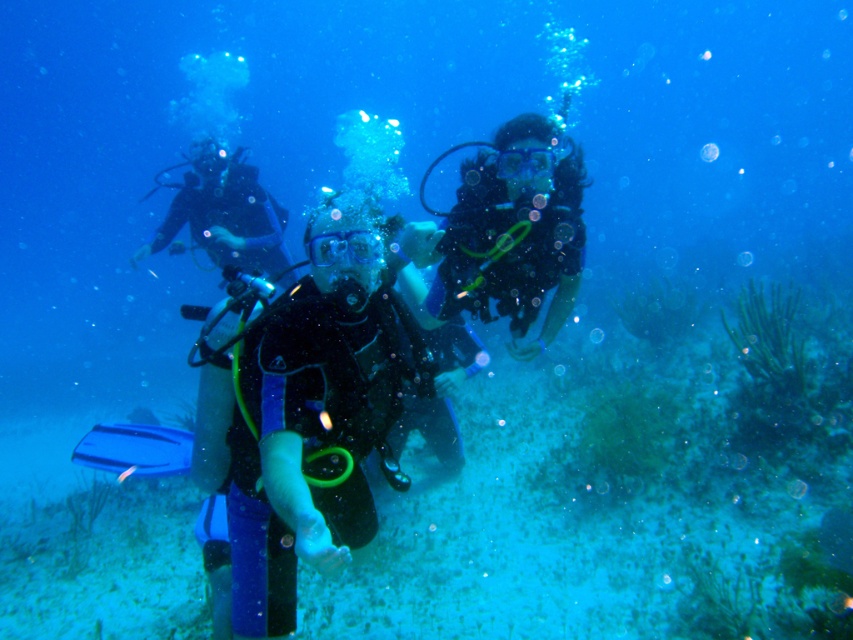
Is black matte scuba diver at center smaller than matte black scuba diver at center?

No, black matte scuba diver at center is not smaller than matte black scuba diver at center.

Is black matte scuba diver at center wider than matte black scuba diver at center?

Indeed, black matte scuba diver at center has a greater width compared to matte black scuba diver at center.

Between point (259, 346) and point (456, 266), which one is positioned in front?

Positioned in front is point (259, 346).

Find the location of a particular element. Image resolution: width=853 pixels, height=640 pixels. black matte scuba diver at center is located at coordinates (315, 413).

Image resolution: width=853 pixels, height=640 pixels. What do you see at coordinates (315, 413) in the screenshot?
I see `black matte scuba diver at center` at bounding box center [315, 413].

This screenshot has width=853, height=640. Identify the location of black matte scuba diver at center. (315, 413).

Locate an element on the screen. black matte scuba diver at center is located at coordinates (x=315, y=413).

Find the location of `matte black scuba diver at center`. matte black scuba diver at center is located at coordinates (514, 230).

Does matte black scuba diver at center have a greater width compared to black matte scuba diver at left?

Incorrect, matte black scuba diver at center's width does not surpass black matte scuba diver at left's.

Where is `matte black scuba diver at center`? Image resolution: width=853 pixels, height=640 pixels. matte black scuba diver at center is located at coordinates (514, 230).